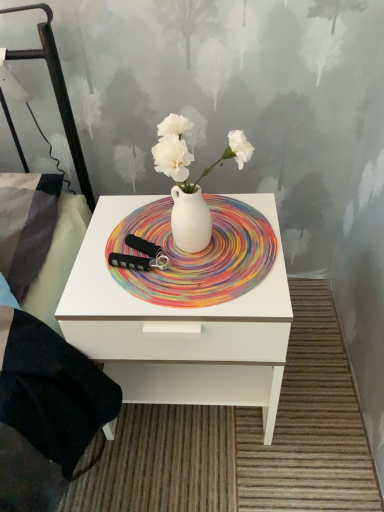
Question: Does white matte vase at center have a lesser height compared to white glossy nightstand at center?

Choices:
 (A) no
 (B) yes

Answer: (B)

Question: Does white matte vase at center have a greater height compared to white glossy nightstand at center?

Choices:
 (A) yes
 (B) no

Answer: (B)

Question: Considering the relative positions of white matte vase at center and white glossy nightstand at center in the image provided, is white matte vase at center in front of white glossy nightstand at center?

Choices:
 (A) yes
 (B) no

Answer: (A)

Question: Considering the relative positions of white matte vase at center and white glossy nightstand at center in the image provided, is white matte vase at center behind white glossy nightstand at center?

Choices:
 (A) yes
 (B) no

Answer: (B)

Question: Is white matte vase at center surrounding white glossy nightstand at center?

Choices:
 (A) yes
 (B) no

Answer: (B)

Question: In terms of height, does white matte vase at center look taller or shorter compared to white matte plate at center?

Choices:
 (A) short
 (B) tall

Answer: (B)

Question: From a real-world perspective, relative to white matte plate at center, is white matte vase at center vertically above or below?

Choices:
 (A) below
 (B) above

Answer: (B)

Question: Considering the relative positions of white matte vase at center and white matte plate at center in the image provided, is white matte vase at center to the left or to the right of white matte plate at center?

Choices:
 (A) left
 (B) right

Answer: (B)

Question: Based on their sizes in the image, would you say white matte vase at center is bigger or smaller than white matte plate at center?

Choices:
 (A) big
 (B) small

Answer: (A)

Question: From a real-world perspective, is white matte plate at center physically located above or below white matte vase at center?

Choices:
 (A) above
 (B) below

Answer: (B)

Question: Looking at the image, does white matte plate at center seem bigger or smaller compared to white matte vase at center?

Choices:
 (A) small
 (B) big

Answer: (A)

Question: Is white matte plate at center situated inside white matte vase at center or outside?

Choices:
 (A) inside
 (B) outside

Answer: (B)

Question: Considering their positions, is white matte plate at center located in front of or behind white matte vase at center?

Choices:
 (A) behind
 (B) front

Answer: (A)

Question: Is point (233, 312) positioned closer to the camera than point (147, 217)?

Choices:
 (A) farther
 (B) closer

Answer: (B)

Question: Relative to white matte plate at center, is white glossy nightstand at center in front or behind?

Choices:
 (A) front
 (B) behind

Answer: (A)